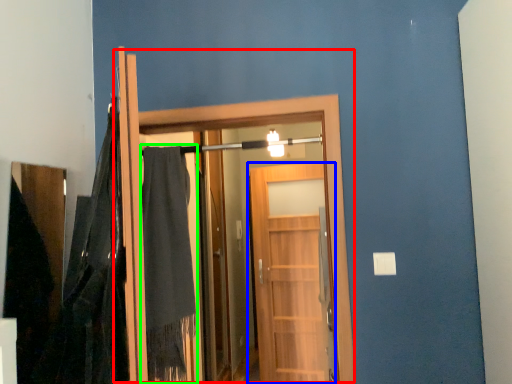
Question: Which is farther away from door (highlighted by a red box)? door (highlighted by a blue box) or robe (highlighted by a green box)?

Choices:
 (A) door
 (B) robe

Answer: (A)